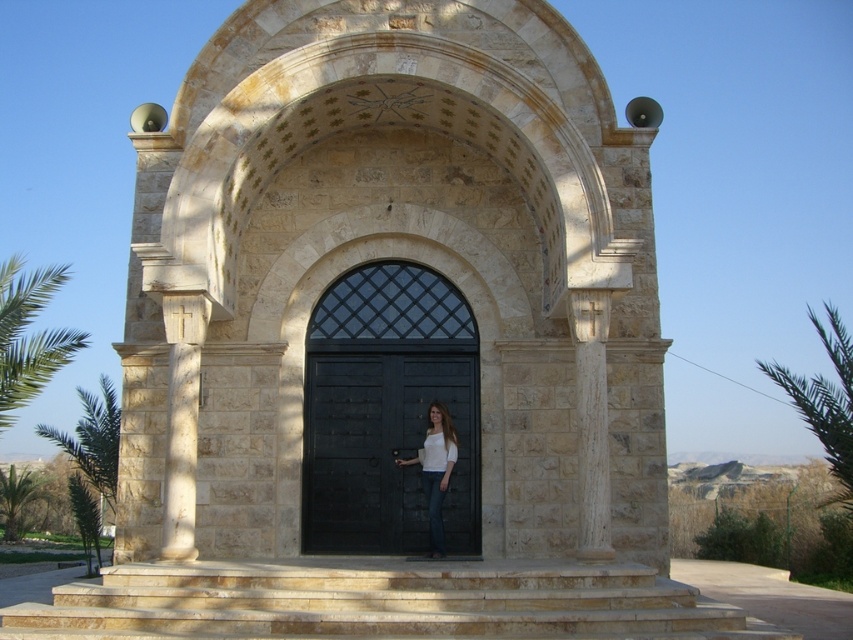
Question: Among these points, which one is farthest from the camera?

Choices:
 (A) (440, 465)
 (B) (431, 353)
 (C) (190, 522)

Answer: (B)

Question: Is black wooden door at center wider than white matte shirt at center?

Choices:
 (A) yes
 (B) no

Answer: (A)

Question: Which point is farther from the camera taking this photo?

Choices:
 (A) (166, 467)
 (B) (709, 612)

Answer: (A)

Question: Which of the following is the closest to the observer?

Choices:
 (A) (405, 576)
 (B) (419, 486)
 (C) (184, 515)
 (D) (569, 300)

Answer: (A)

Question: Does beige stone stairs at center have a lesser width compared to white matte shirt at center?

Choices:
 (A) yes
 (B) no

Answer: (B)

Question: Considering the relative positions of beige stone stairs at center and light beige stone column at center-left in the image provided, where is beige stone stairs at center located with respect to light beige stone column at center-left?

Choices:
 (A) above
 (B) below

Answer: (B)